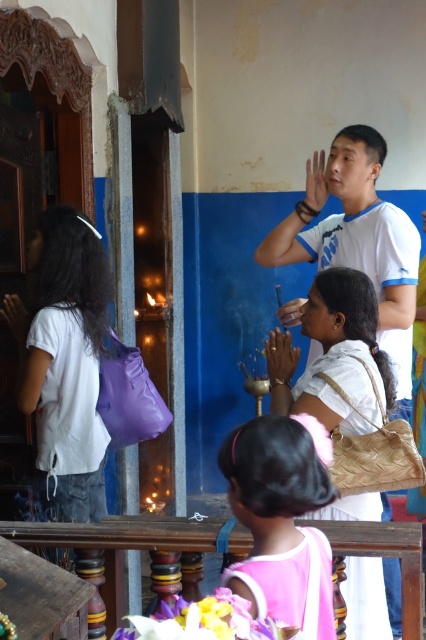
Question: Which point appears closest to the camera in this image?

Choices:
 (A) (359, 516)
 (B) (235, 493)

Answer: (B)

Question: Is pink fabric dress at lower center below beige woven bag at center?

Choices:
 (A) yes
 (B) no

Answer: (A)

Question: Is pink fabric dress at lower center further to camera compared to beige woven bag at center?

Choices:
 (A) yes
 (B) no

Answer: (B)

Question: Which point is closer to the camera?

Choices:
 (A) pink fabric dress at lower center
 (B) beige woven bag at center

Answer: (A)

Question: Which object is closer to the camera taking this photo?

Choices:
 (A) beige woven bag at center
 (B) pink fabric dress at lower center

Answer: (B)

Question: Is pink fabric dress at lower center closer to the viewer compared to beige woven bag at center?

Choices:
 (A) yes
 (B) no

Answer: (A)